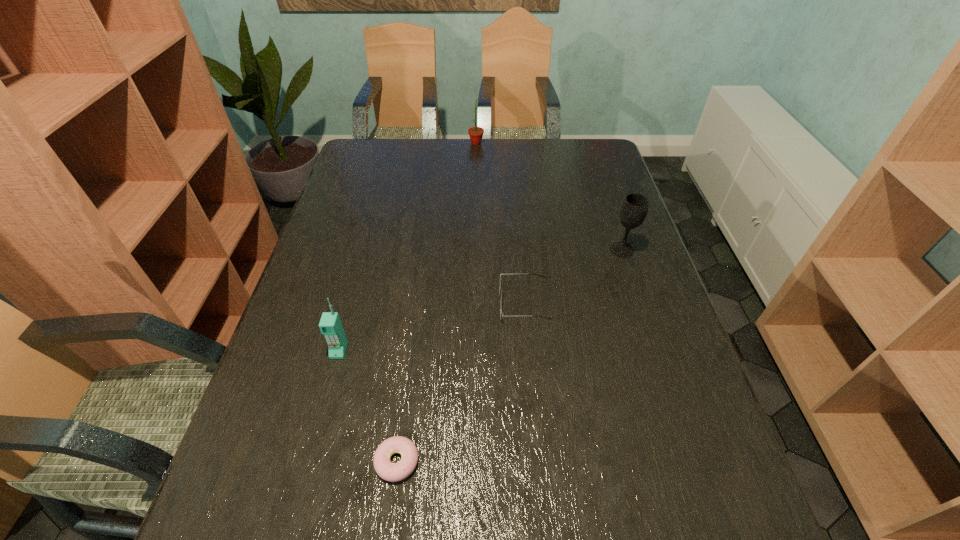
Image resolution: width=960 pixels, height=540 pixels. In order to click on free region at the far edge in this screenshot , I will do `click(534, 170)`.

This screenshot has height=540, width=960. What are the coordinates of `vacant space at the left edge of the desktop` in the screenshot? It's located at (251, 496).

Image resolution: width=960 pixels, height=540 pixels. Find the location of `vacant area at the right edge`. vacant area at the right edge is located at coordinates click(x=640, y=234).

In the image, there is a desktop. Identify the location of vacant space at the far right corner. This screenshot has height=540, width=960. (580, 140).

The width and height of the screenshot is (960, 540). What are the coordinates of `vacant space that's between the doughnut and the second nearest object` in the screenshot? It's located at (368, 406).

Where is `vacant space that is in between the wineglass and the nearest object`? This screenshot has width=960, height=540. vacant space that is in between the wineglass and the nearest object is located at coordinates (510, 355).

The image size is (960, 540). Find the location of `vacant area that lies between the doughnut and the fourth tallest object`. vacant area that lies between the doughnut and the fourth tallest object is located at coordinates (461, 382).

At what (x,y) coordinates should I click in order to perform the action: click on empty location between the fourth object from right to left and the rightmost object. Please return your answer as a coordinate pair (x, y). Looking at the image, I should click on (510, 355).

At what (x,y) coordinates should I click in order to perform the action: click on empty space that is in between the shortest object and the second nearest object. Please return your answer as a coordinate pair (x, y). Image resolution: width=960 pixels, height=540 pixels. Looking at the image, I should click on (368, 406).

At what (x,y) coordinates should I click in order to perform the action: click on free space between the sunflower and the second object from right to left. Please return your answer as a coordinate pair (x, y). Image resolution: width=960 pixels, height=540 pixels. Looking at the image, I should click on click(x=500, y=223).